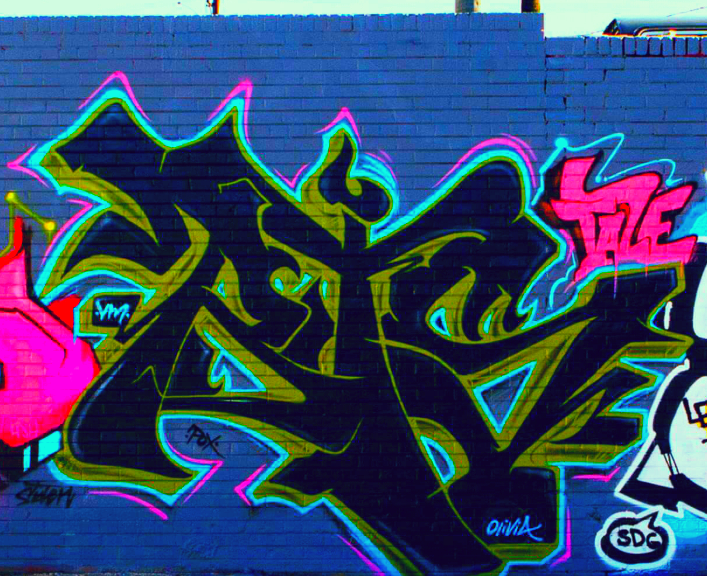
The width and height of the screenshot is (707, 577). I want to click on blue brick wall, so click(450, 96).